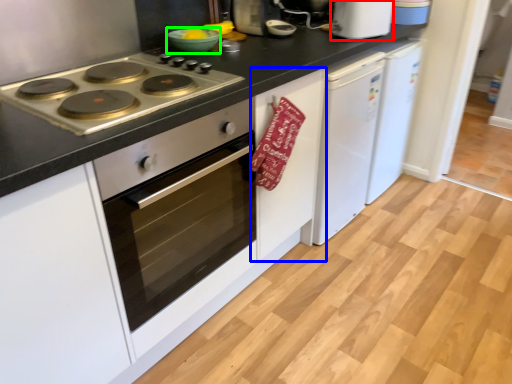
Question: Which object is positioned farthest from kitchen appliance (highlighted by a red box)? Select from cabinetry (highlighted by a blue box) and bowl (highlighted by a green box).

Choices:
 (A) cabinetry
 (B) bowl

Answer: (B)